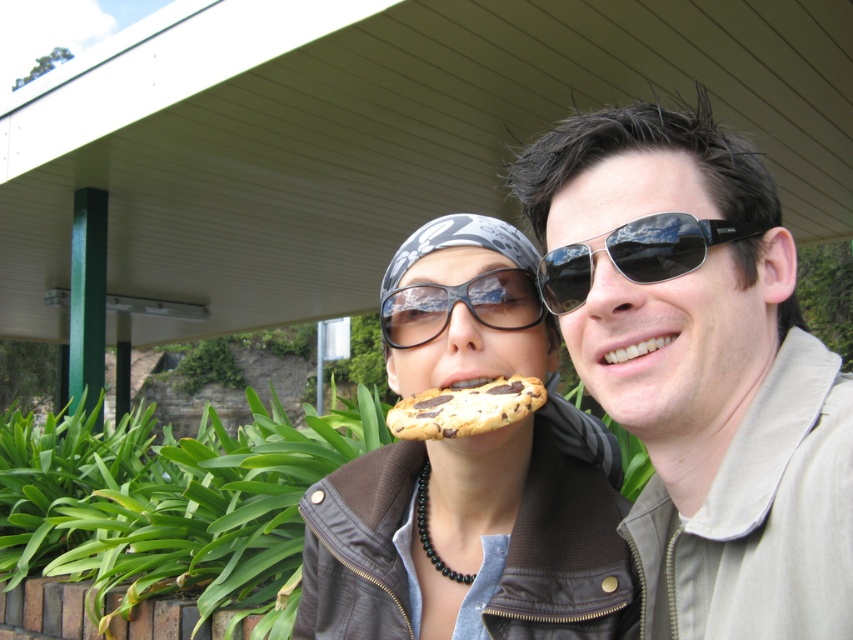
Who is positioned more to the right, matte brown jacket at center or chocolate chip cookie at center?

matte brown jacket at center is more to the right.

The image size is (853, 640). Describe the element at coordinates (701, 371) in the screenshot. I see `matte brown jacket at center` at that location.

Is point (717, 529) closer to viewer compared to point (397, 413)?

Yes.

Locate an element on the screen. matte brown jacket at center is located at coordinates (701, 371).

Is point (633, 627) less distant than point (450, 285)?

No, it is behind (450, 285).

Who is more forward, (416,291) or (389,323)?

Positioned in front is point (416,291).

Identify the location of brown leather jacket at center. (473, 477).

Does brown leather jacket at center have a smaller size compared to sunglasses at center?

No.

Is brown leather jacket at center to the left of sunglasses at center from the viewer's perspective?

Indeed, brown leather jacket at center is positioned on the left side of sunglasses at center.

Between point (418, 376) and point (566, 310), which one is positioned in front?

Point (566, 310) is in front.

Find the location of `brown leather jacket at center`. brown leather jacket at center is located at coordinates (473, 477).